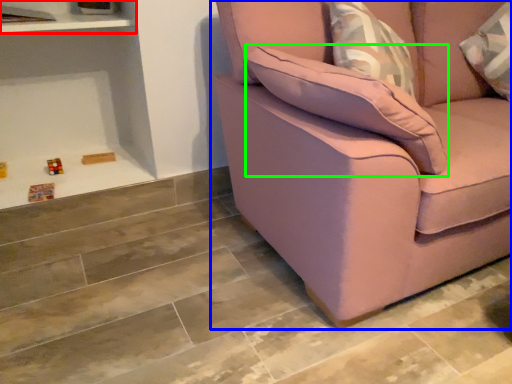
Question: Estimate the real-world distances between objects in this image. Which object is farther from shelf (highlighted by a red box), studio couch (highlighted by a blue box) or pillow (highlighted by a green box)?

Choices:
 (A) studio couch
 (B) pillow

Answer: (A)